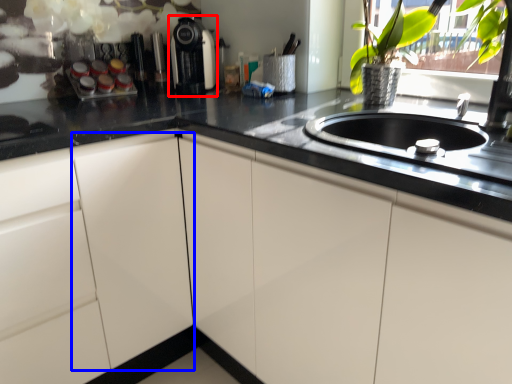
Question: Which point is closer to the camera, coffee machine (highlighted by a red box) or cabinetry (highlighted by a blue box)?

Choices:
 (A) coffee machine
 (B) cabinetry

Answer: (B)